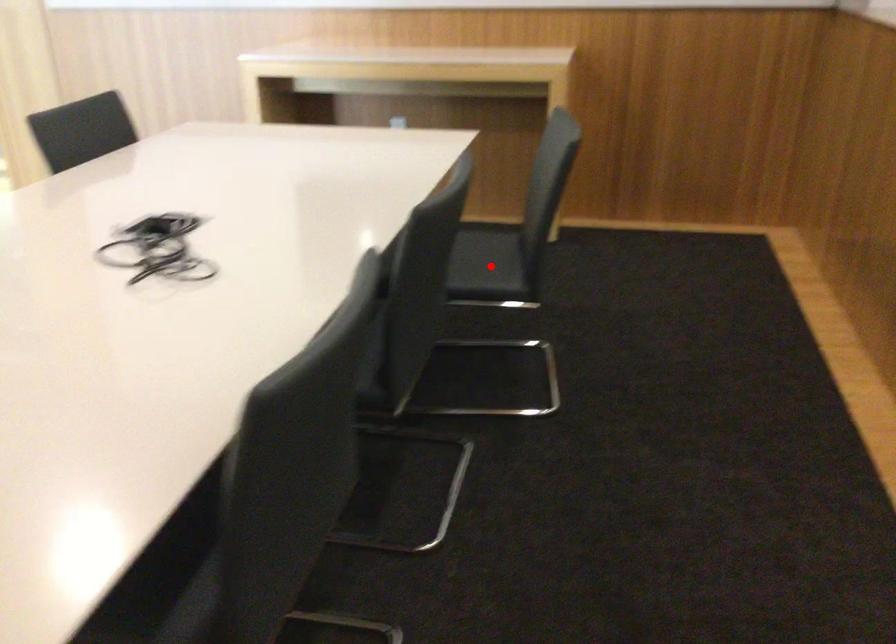
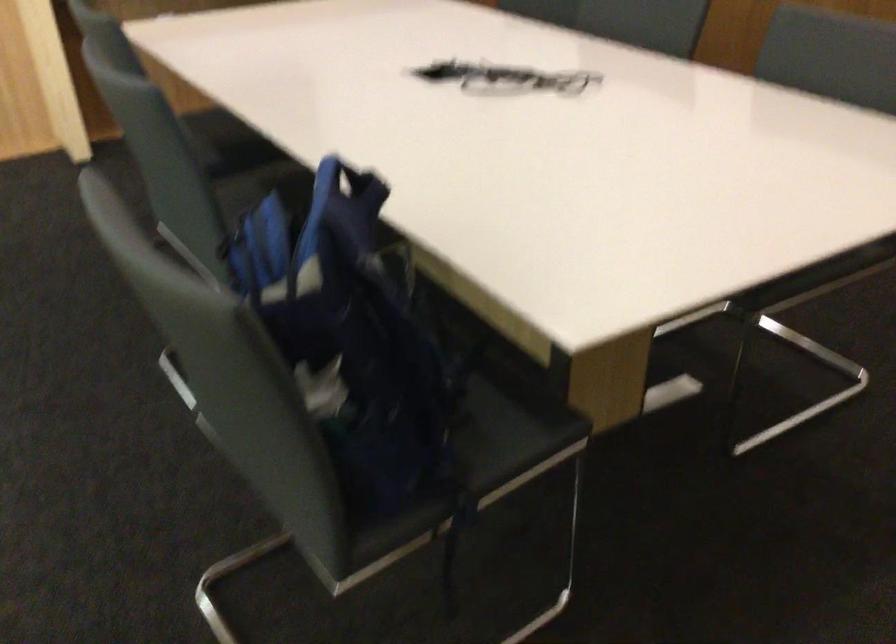
Question: I am providing you with two images of the same scene from different viewpoints. A red point is marked on the first image. At the location where the point appears in image 1, is it still visible in image 2?

Choices:
 (A) Yes
 (B) No

Answer: (B)